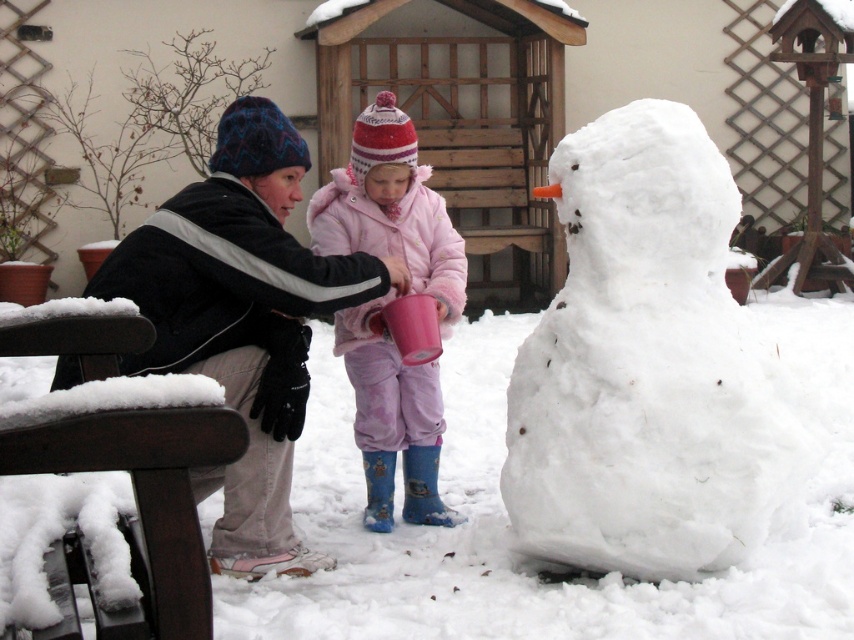
Can you confirm if black fleece jacket at left is shorter than pink fleece coat at center?

Yes, black fleece jacket at left is shorter than pink fleece coat at center.

Based on the photo, can you confirm if black fleece jacket at left is positioned below pink fleece coat at center?

Yes.

Which is in front, point (200, 184) or point (420, 512)?

Positioned in front is point (200, 184).

Where is `black fleece jacket at left`? The height and width of the screenshot is (640, 854). black fleece jacket at left is located at coordinates 243,317.

Is point (677, 320) farther from camera compared to point (183, 260)?

That is True.

Which is in front, point (537, 515) or point (262, 161)?

Point (262, 161) is more forward.

I want to click on white fluffy snowman at right, so click(646, 365).

Is white fluffy snowman at right to the left of pink fleece coat at center from the viewer's perspective?

No, white fluffy snowman at right is not to the left of pink fleece coat at center.

Who is more distant from viewer, (613, 161) or (448, 227)?

The point (448, 227) is behind.

Is point (512, 515) positioned in front of point (373, 124)?

Yes, point (512, 515) is in front of point (373, 124).

Where is `white fluffy snowman at right`? Image resolution: width=854 pixels, height=640 pixels. white fluffy snowman at right is located at coordinates (646, 365).